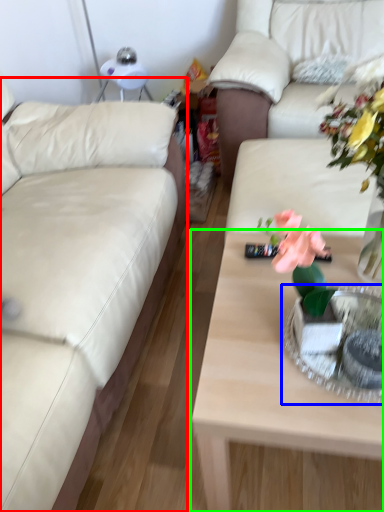
Question: Considering the real-world distances, which object is farthest from studio couch (highlighted by a red box)? tableware (highlighted by a blue box) or coffee table (highlighted by a green box)?

Choices:
 (A) tableware
 (B) coffee table

Answer: (A)